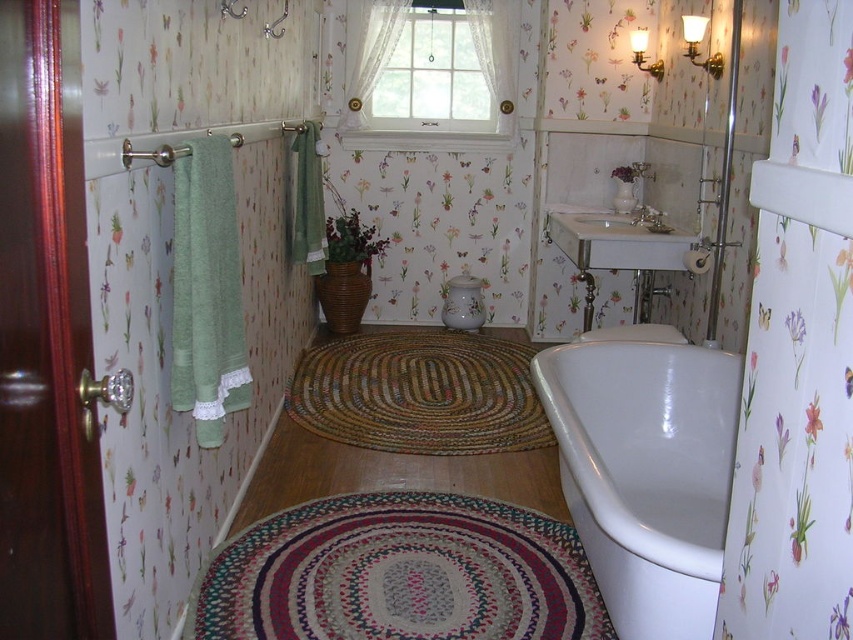
Which is in front, point (631, 509) or point (560, 230)?

Point (631, 509) is in front.

Is white glossy bathtub at lower right taller than white porcelain sink at center?

Yes.

This screenshot has width=853, height=640. I want to click on white glossy bathtub at lower right, so click(x=646, y=474).

What are the coordinates of `white glossy bathtub at lower right` in the screenshot? It's located at (646, 474).